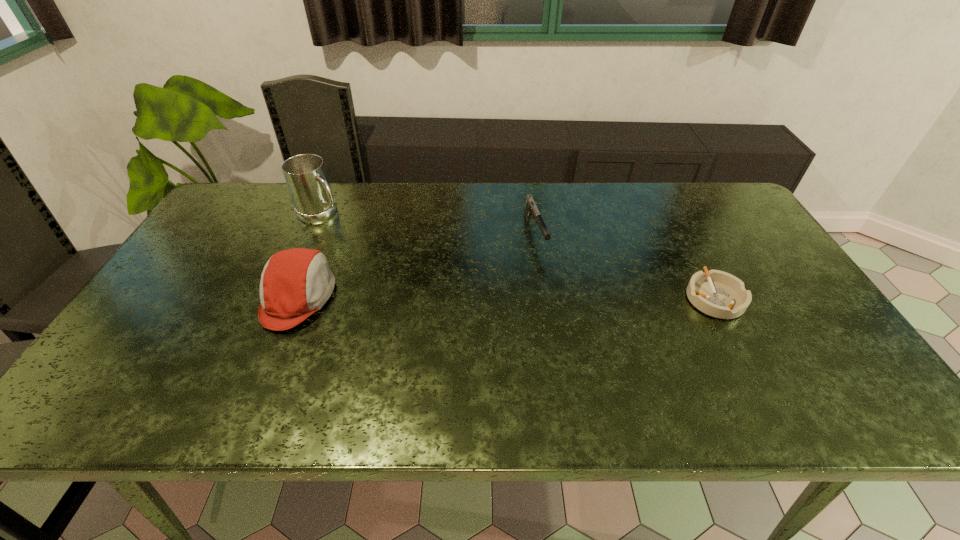
Locate an element on the screen. vacant space situated 0.380m at the muzzle end of the third object from left to right is located at coordinates (588, 366).

Where is `vacant area situated 0.280m at the muzzle end of the third object from left to right`? This screenshot has height=540, width=960. vacant area situated 0.280m at the muzzle end of the third object from left to right is located at coordinates (573, 332).

Identify the location of vacant space situated 0.330m at the muzzle end of the third object from left to right. (580, 348).

I want to click on vacant space located 0.280m on the side of the mug with the handle, so click(x=396, y=264).

You are a GUI agent. You are given a task and a screenshot of the screen. Output one action in this format:
    pyautogui.click(x=<x>, y=<y>)
    Task: Click on the free spot located 0.080m on the side of the mug with the handle
    This screenshot has height=540, width=960.
    Given the screenshot: What is the action you would take?
    pyautogui.click(x=352, y=234)

Find the location of `vacant region located on the side of the mug with the handle`. vacant region located on the side of the mug with the handle is located at coordinates (373, 248).

Find the location of a particular element. The width and height of the screenshot is (960, 540). gun located in the far edge section of the desktop is located at coordinates (531, 209).

Where is `mug at the far edge`? This screenshot has width=960, height=540. mug at the far edge is located at coordinates (305, 174).

Locate an element on the screen. object located in the right edge section of the desktop is located at coordinates (716, 293).

Locate an element on the screen. free location at the far edge is located at coordinates (444, 190).